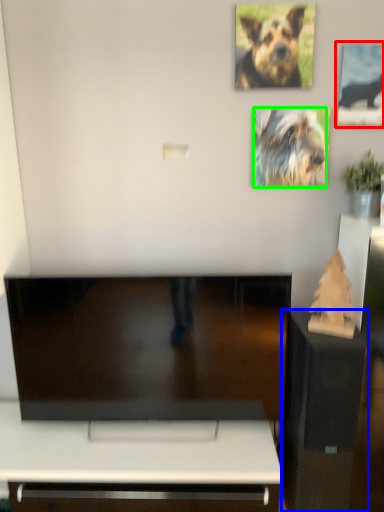
Question: Which is nearer to the picture frame (highlighted by a red box)? furniture (highlighted by a blue box) or dog (highlighted by a green box).

Choices:
 (A) furniture
 (B) dog

Answer: (B)